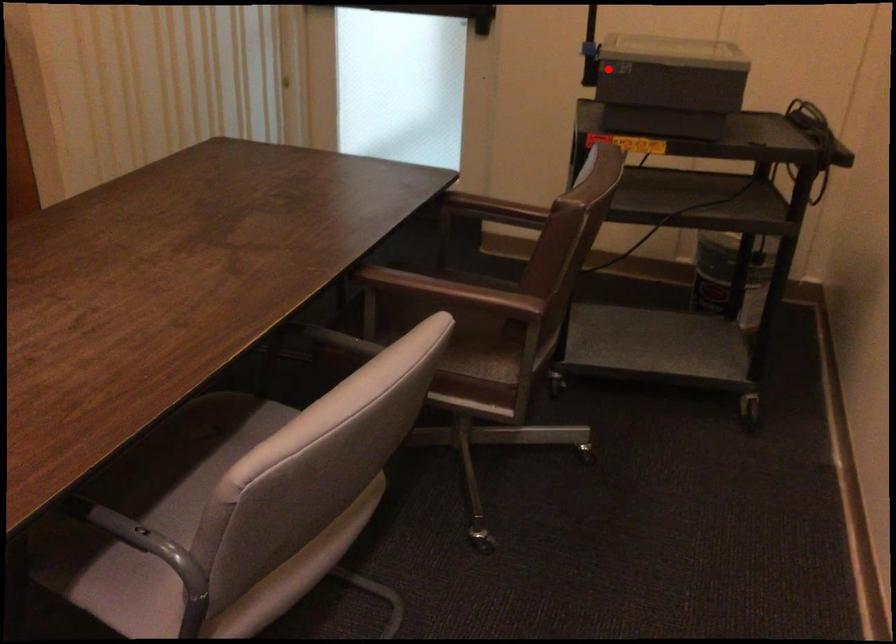
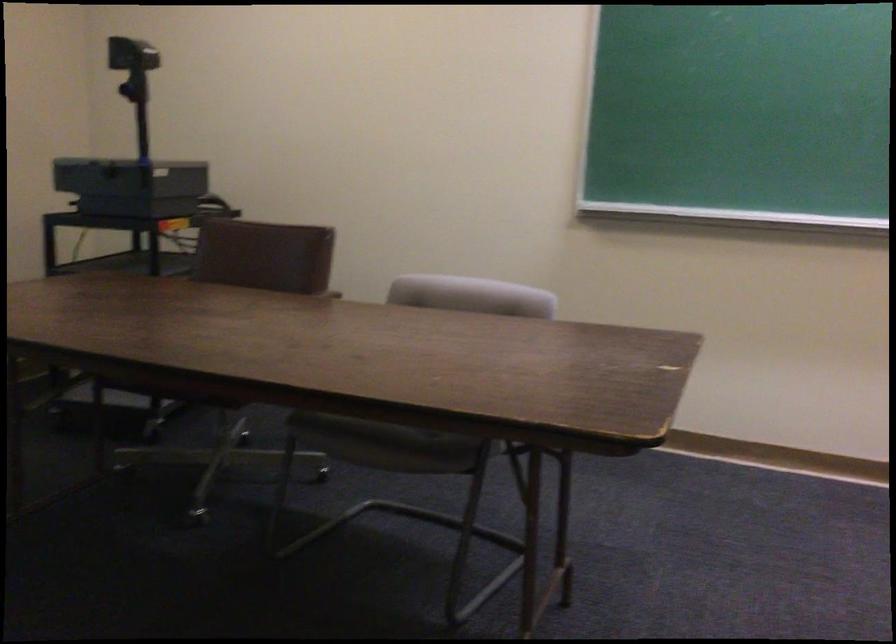
In the second image, find the point that corresponds to the highlighted location in the first image.

(131, 180)